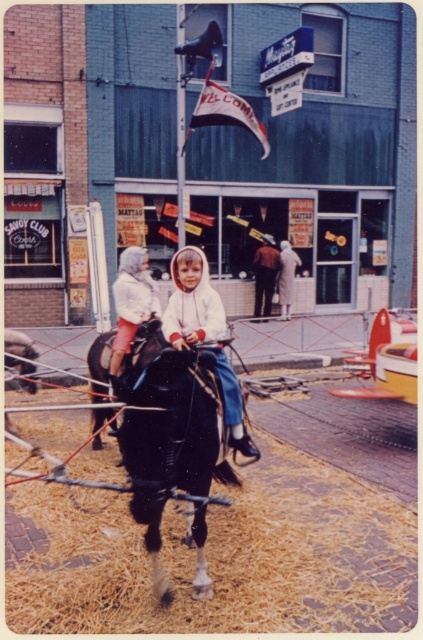
You are a parent at the carnival looking for your child who is wearing a dark brown leather jacket at center. You see the black glossy horse at center nearby. Can you tell if the horse is wider than the jacket?

The black glossy horse at center is wider than the dark brown leather jacket at center, so yes, the horse is wider than the jacket.

You are standing at the carnival and want to determine which of the two points, point (186, 470) or point (236, 442), is closer to you. Based on the scene, which point is nearer?

Point (186, 470) is closer to the viewer than point (236, 442).

You are a parent at the carnival and want to ensure your child is safe. You see the black glossy horse at center and the dark brown leather jacket at center. Which object is positioned lower in the image?

The black glossy horse at center is located below dark brown leather jacket at center, so the horse is lower in the image.